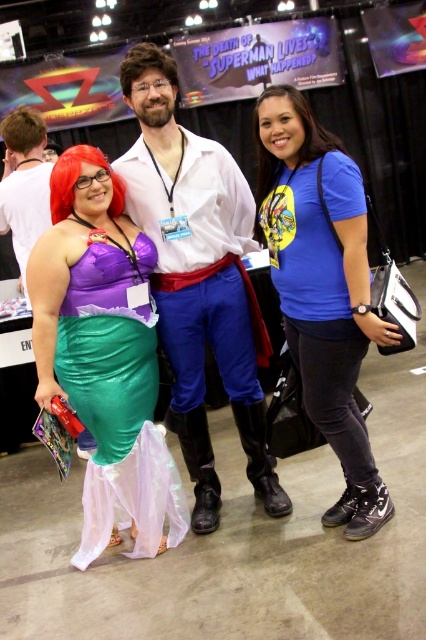
Question: Estimate the real-world distances between objects in this image. Which object is farther from the blue cotton shirt at center?

Choices:
 (A) shiny green fabric dress at left
 (B) matte white shirt at center
 (C) matte black boots at lower center

Answer: (C)

Question: Can you confirm if shiny green fabric dress at left is thinner than matte black boots at lower center?

Choices:
 (A) yes
 (B) no

Answer: (B)

Question: Can you confirm if shiny green fabric dress at left is positioned to the left of blue cotton shirt at center?

Choices:
 (A) no
 (B) yes

Answer: (B)

Question: Which object is farther from the camera taking this photo?

Choices:
 (A) matte white shirt at center
 (B) shiny green fabric dress at left
 (C) matte black boots at lower center

Answer: (C)

Question: Does blue cotton shirt at center appear under matte black boots at lower center?

Choices:
 (A) no
 (B) yes

Answer: (B)

Question: Which point appears closest to the camera in this image?

Choices:
 (A) (48, 355)
 (B) (204, 173)

Answer: (A)